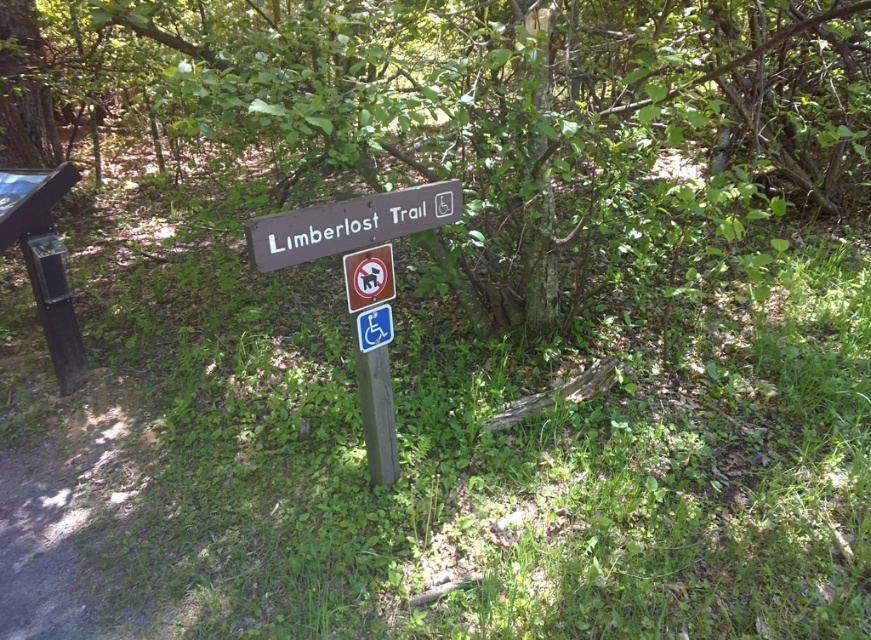
Question: Which of the following is the farthest from the observer?

Choices:
 (A) metallic rectangular sign at center
 (B) brown wood tree at center
 (C) blue plastic handicap sign at center

Answer: (C)

Question: Can you confirm if brown wood tree at center is positioned below blue plastic handicap sign at center?

Choices:
 (A) yes
 (B) no

Answer: (B)

Question: Is metallic rectangular sign at center behind blue plastic handicap sign at center?

Choices:
 (A) no
 (B) yes

Answer: (A)

Question: Where is brown wood sign at center located in relation to blue plastic handicap sign at center in the image?

Choices:
 (A) above
 (B) below

Answer: (A)

Question: Which object appears farthest from the camera in this image?

Choices:
 (A) metallic rectangular sign at center
 (B) blue plastic handicap sign at center

Answer: (B)

Question: Which object is the closest to the blue plastic handicap sign at center?

Choices:
 (A) metallic rectangular sign at center
 (B) brown wood sign at center
 (C) brown wood tree at center

Answer: (A)